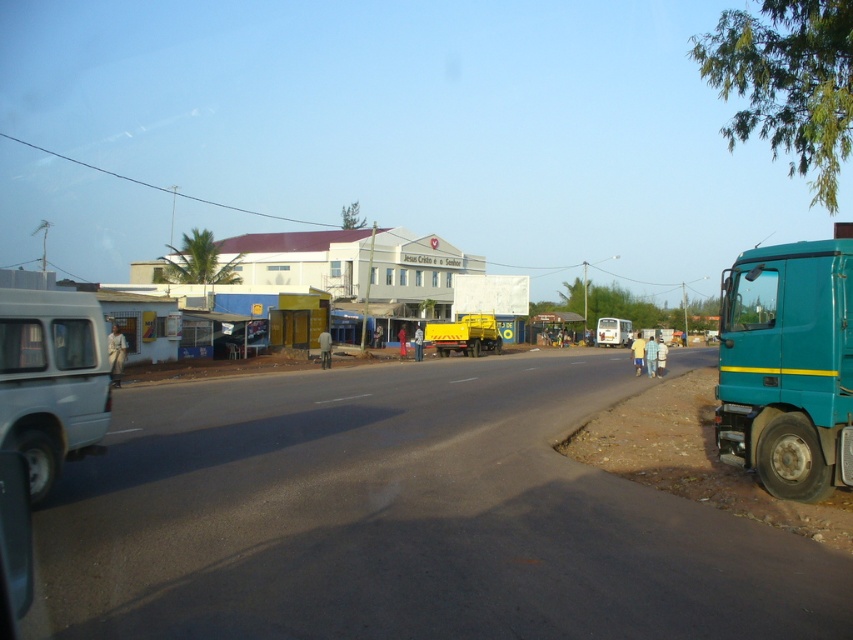
Who is more distant from viewer, (83, 428) or (612, 317)?

Point (612, 317)

Find the location of a particular element. The image size is (853, 640). light blue matte van at left is located at coordinates (51, 380).

Can you confirm if teal matte truck at right is positioned to the right of light blue matte van at left?

Yes, teal matte truck at right is to the right of light blue matte van at left.

Who is more distant from viewer, (x=796, y=428) or (x=3, y=380)?

The point (x=796, y=428) is more distant.

What are the coordinates of `teal matte truck at right` in the screenshot? It's located at (787, 368).

Is light blue matte van at left positioned at the back of yellow matte truck at center?

That is False.

Does light blue matte van at left have a greater height compared to yellow matte truck at center?

In fact, light blue matte van at left may be shorter than yellow matte truck at center.

Is point (80, 394) behind point (460, 333)?

That is False.

Where is `light blue matte van at left`? The height and width of the screenshot is (640, 853). light blue matte van at left is located at coordinates (51, 380).